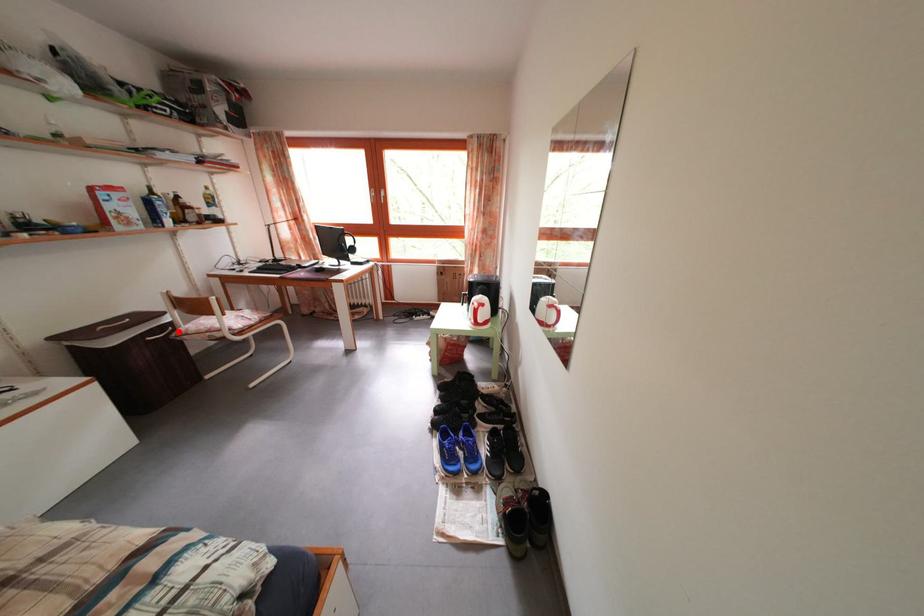
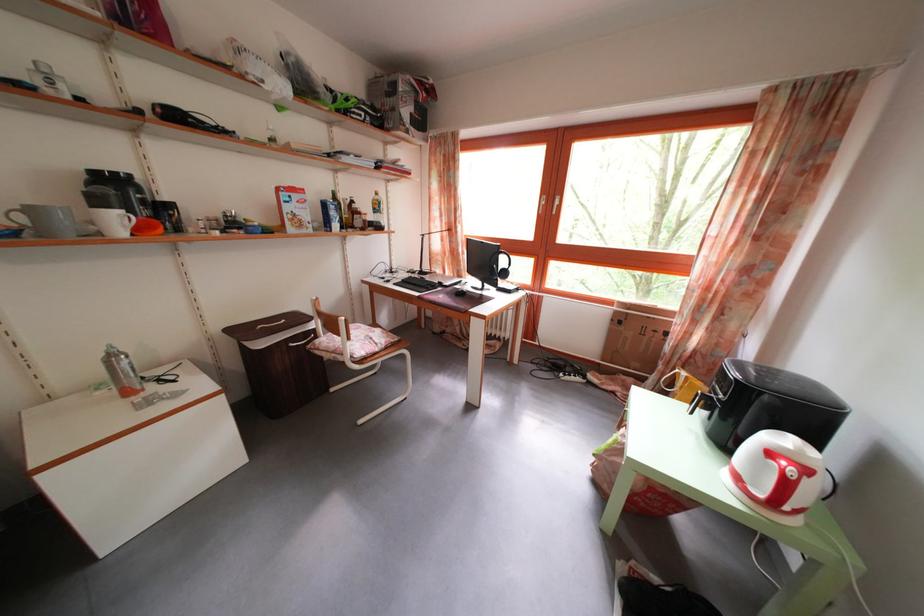
Find the pixel in the second image that matches the highlighted location in the first image.

(322, 339)